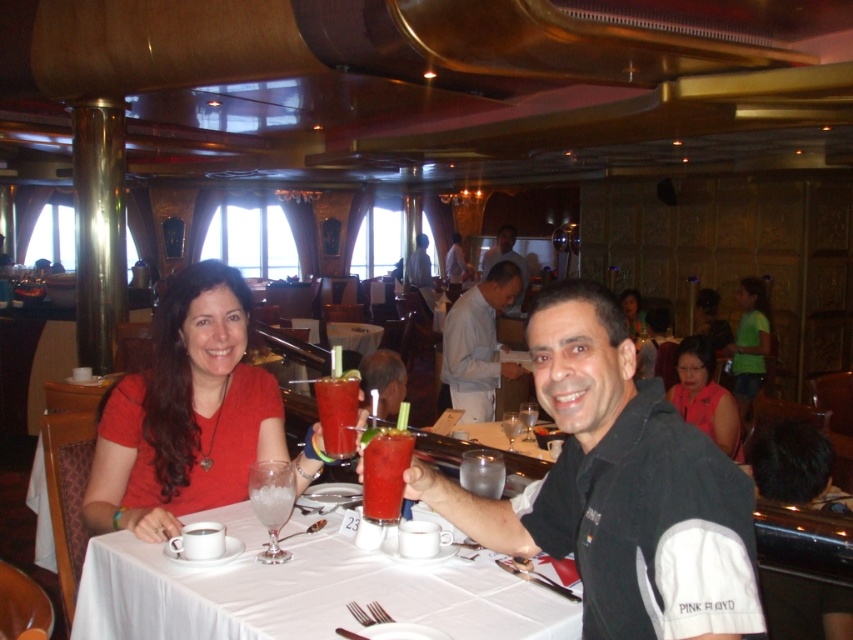
In the scene shown: Can you confirm if white glossy table at center is bigger than matte red dress at center?

No, white glossy table at center is not bigger than matte red dress at center.

At what (x,y) coordinates should I click in order to perform the action: click on white glossy table at center. Please return your answer as a coordinate pair (x, y). The height and width of the screenshot is (640, 853). Looking at the image, I should click on (300, 589).

Locate an element on the screen. white glossy table at center is located at coordinates (300, 589).

Which is more to the left, clear glass at table center or matte black hair at center?

Positioned to the left is clear glass at table center.

Does clear glass at table center have a smaller size compared to matte black hair at center?

Correct, clear glass at table center occupies less space than matte black hair at center.

Where is `clear glass at table center`? The width and height of the screenshot is (853, 640). clear glass at table center is located at coordinates (271, 502).

This screenshot has width=853, height=640. In order to click on clear glass at table center in this screenshot , I will do `click(271, 502)`.

Is black matte shirt at center taller than white glossy table at center?

Yes, black matte shirt at center is taller than white glossy table at center.

Between black matte shirt at center and white glossy table at center, which one has less height?

white glossy table at center is shorter.

Who is more forward, [637,481] or [318,576]?

Positioned in front is point [637,481].

Find the location of a particular element. black matte shirt at center is located at coordinates (619, 488).